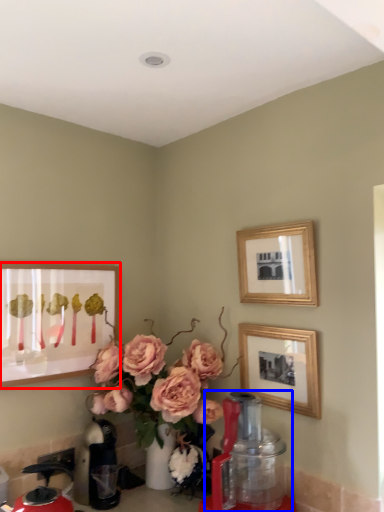
Question: Which of the following is the closest to the observer, picture frame (highlighted by a red box) or blender (highlighted by a blue box)?

Choices:
 (A) picture frame
 (B) blender

Answer: (B)